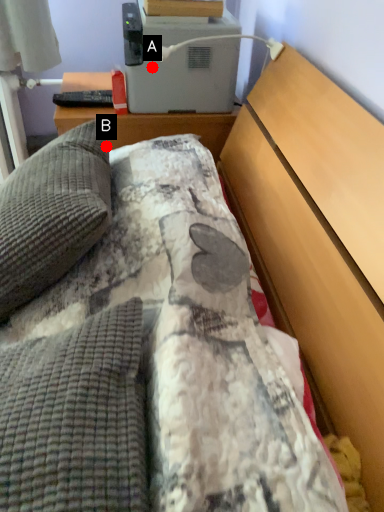
Question: Two points are circled on the image, labeled by A and B beside each circle. Which point is closer to the camera taking this photo?

Choices:
 (A) A is closer
 (B) B is closer

Answer: (B)